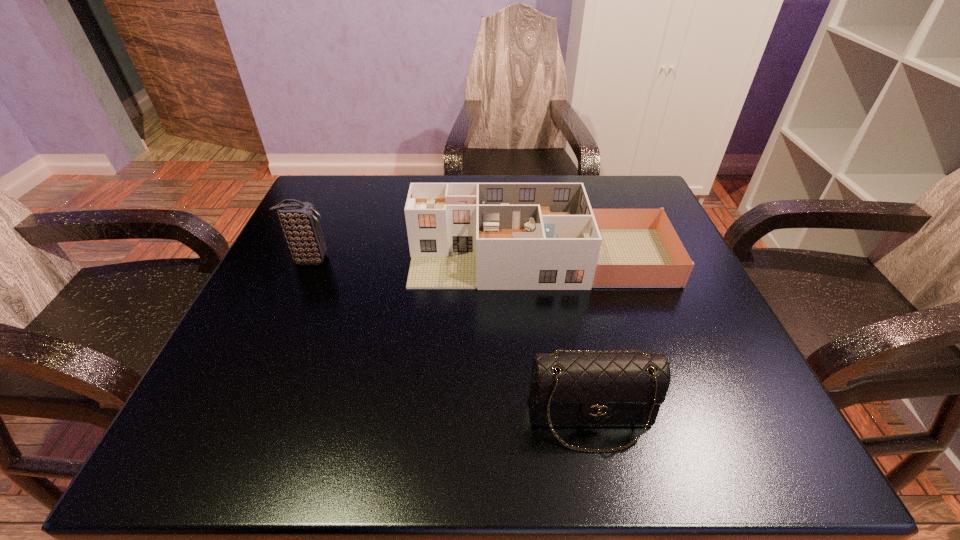
Where is `the farther clutch bag`? the farther clutch bag is located at coordinates (299, 220).

Where is `the left clutch bag`? The image size is (960, 540). the left clutch bag is located at coordinates (299, 220).

I want to click on dollhouse, so click(488, 236).

Where is `the nearer clutch bag`? This screenshot has height=540, width=960. the nearer clutch bag is located at coordinates (589, 389).

This screenshot has width=960, height=540. What are the coordinates of `the nearest object` in the screenshot? It's located at (589, 389).

Find the location of `vacant space situated with the zip open on the left clutch bag`. vacant space situated with the zip open on the left clutch bag is located at coordinates (390, 259).

Locate an element on the screen. vacant space located at the entrance of the dollhouse is located at coordinates (377, 258).

The width and height of the screenshot is (960, 540). Identify the location of blank space located 0.230m at the entrance of the dollhouse. (299, 258).

Locate an element on the screen. This screenshot has width=960, height=540. vacant space located 0.070m at the entrance of the dollhouse is located at coordinates (377, 258).

This screenshot has width=960, height=540. What are the coordinates of `object that is at the near edge` in the screenshot? It's located at (589, 389).